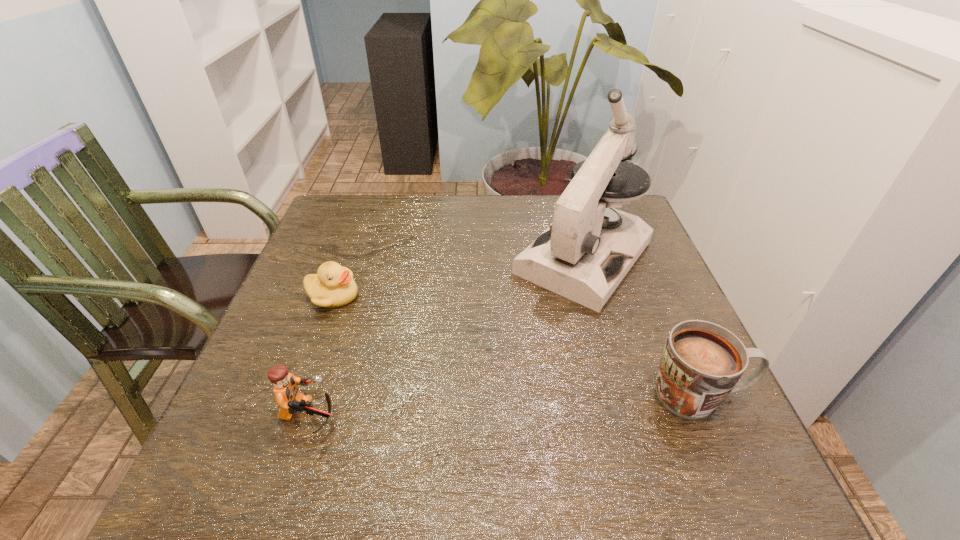
This screenshot has height=540, width=960. I want to click on object at the near right corner, so click(x=701, y=364).

Identify the location of free space at the far edge. coord(523,233).

Where is `free space at the near edge of the desktop`? free space at the near edge of the desktop is located at coordinates (400, 399).

In the image, there is a desktop. Where is `free space at the left edge`? free space at the left edge is located at coordinates (269, 342).

This screenshot has height=540, width=960. In the image, there is a desktop. Find the location of `free space at the right edge`. free space at the right edge is located at coordinates [x=648, y=351].

Locate an element on the screen. The image size is (960, 540). vacant space at the far left corner of the desktop is located at coordinates (327, 212).

You are a GUI agent. You are given a task and a screenshot of the screen. Output one action in this format:
    pyautogui.click(x=<x>, y=<y>)
    Task: Click on the free spot between the microscope and the Lego
    
    Given the screenshot: What is the action you would take?
    pyautogui.click(x=446, y=337)

Find the location of a particular element. The width and height of the screenshot is (960, 540). free space between the Lego and the mug is located at coordinates (504, 406).

This screenshot has height=540, width=960. What are the coordinates of `empty location between the shortest object and the microscope` in the screenshot? It's located at (458, 276).

I want to click on empty space between the mug and the duckling, so coord(516,345).